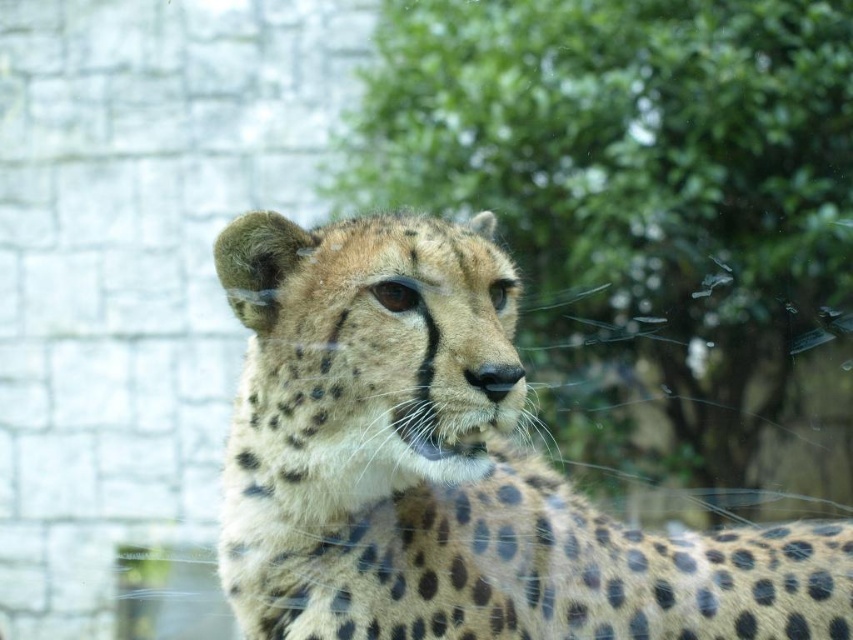
You are standing in front of a zoo enclosure where you can see a cheetah behind a glass barrier. The enclosure has a green leafy tree at upper center. If you want to take a photo of the cheetah with the tree in the background, will the tree be in focus if you focus on the cheetah?

The green leafy tree at upper center is 58.51 feet from the viewer. Since the tree is far away from the cheetah, focusing on the cheetah may not keep the tree in focus unless the depth of field is sufficient to include both distances. However, without knowing the camera settings, it is uncertain. But given the significant distance between the cheetah and the tree, it is possible the tree might be out of focus.

You are a zookeeper observing the cheetah enclosure. You notice the green leafy tree at upper center and the spotted fur cheetah at center. Which object is taller?

The spotted fur cheetah at center is taller than the green leafy tree at upper center.